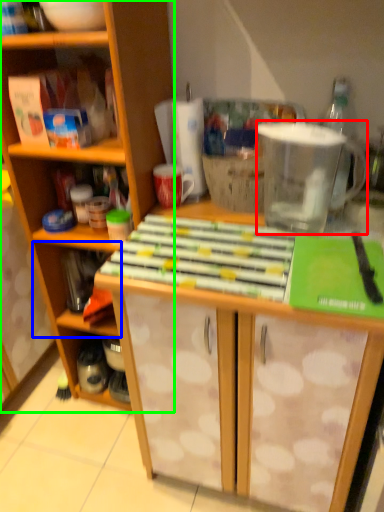
Question: Considering the real-world distances, which object is farthest from appliance (highlighted by a red box)? shelf (highlighted by a blue box) or cabinetry (highlighted by a green box)?

Choices:
 (A) shelf
 (B) cabinetry

Answer: (A)